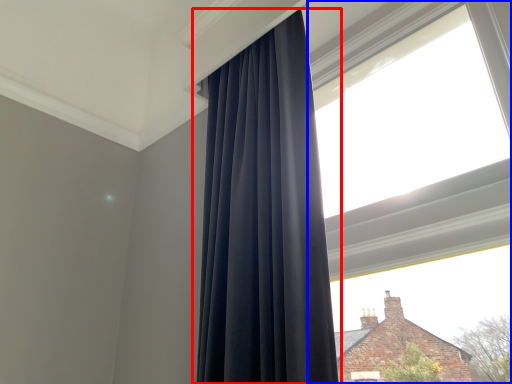
Question: Among these objects, which one is nearest to the camera, curtain (highlighted by a red box) or window (highlighted by a blue box)?

Choices:
 (A) curtain
 (B) window

Answer: (B)